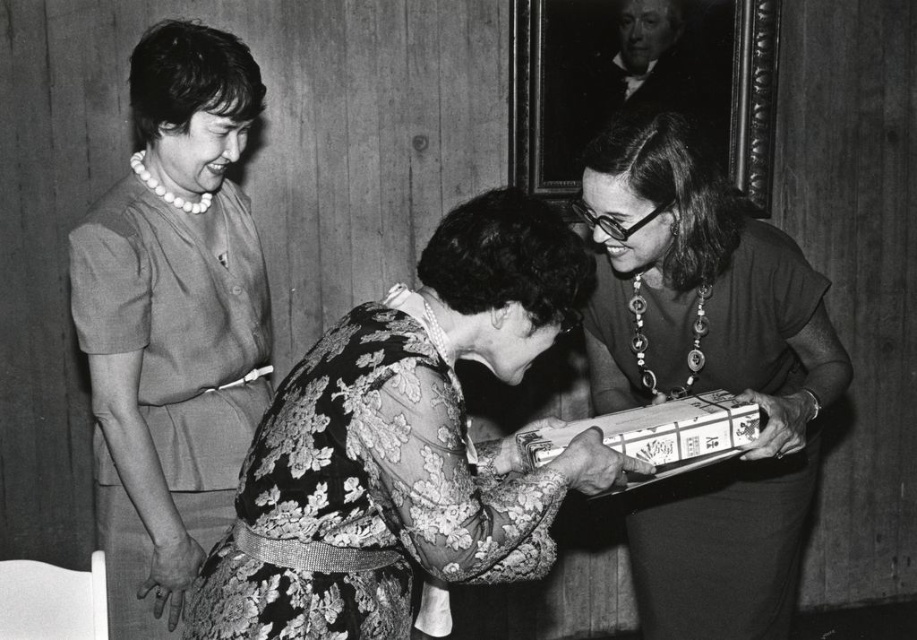
Question: Does matte black box at center appear under pearl necklace at upper left?

Choices:
 (A) no
 (B) yes

Answer: (B)

Question: Can you confirm if matte black box at center is smaller than pearl necklace at upper left?

Choices:
 (A) yes
 (B) no

Answer: (B)

Question: Does matte black box at center lie in front of pearl necklace at upper left?

Choices:
 (A) yes
 (B) no

Answer: (A)

Question: Estimate the real-world distances between objects in this image. Which object is closer to the matte black box at center?

Choices:
 (A) pearl necklace at upper left
 (B) patterned paper package at center
 (C) floral-patterned dress at center

Answer: (B)

Question: Which point is farther to the camera?

Choices:
 (A) (185, 356)
 (B) (558, 244)
 (C) (683, 464)

Answer: (A)

Question: Among these points, which one is farthest from the camera?

Choices:
 (A) (529, 464)
 (B) (246, 218)
 (C) (615, 186)
 (D) (241, 486)

Answer: (B)